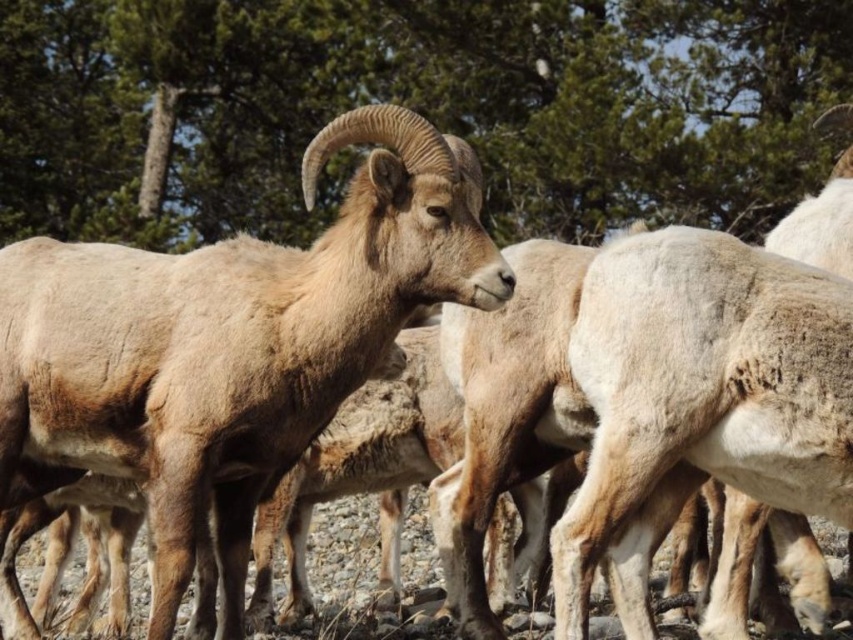
Question: From the image, what is the correct spatial relationship of green leafy tree at upper center in relation to brown woolen goat at center?

Choices:
 (A) left
 (B) right

Answer: (B)

Question: Which of the following is the closest to the observer?

Choices:
 (A) brown woolen goat at center
 (B) green leafy tree at upper center

Answer: (A)

Question: Which point is closer to the camera?

Choices:
 (A) brown woolen goat at center
 (B) green leafy tree at upper center

Answer: (A)

Question: Can you confirm if green leafy tree at upper center is positioned below brown woolen goat at center?

Choices:
 (A) yes
 (B) no

Answer: (B)

Question: Does green leafy tree at upper center have a larger size compared to brown woolen goat at center?

Choices:
 (A) no
 (B) yes

Answer: (B)

Question: Which of the following is the farthest from the observer?

Choices:
 (A) (822, 88)
 (B) (59, 326)

Answer: (A)